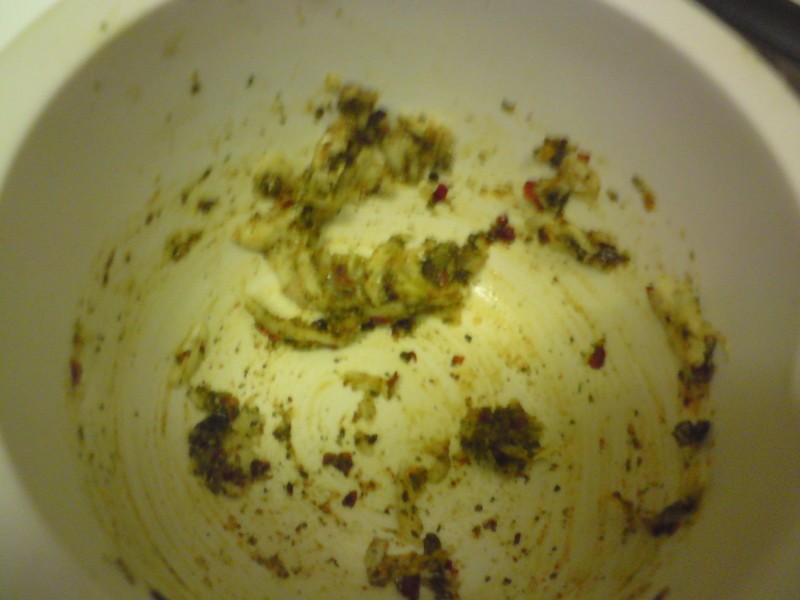
At what (x,y) coordinates should I click in order to perform the action: click on rim of bowl. Please return your answer as a coordinate pair (x, y). The width and height of the screenshot is (800, 600). Looking at the image, I should click on (38, 64), (697, 47), (41, 580).